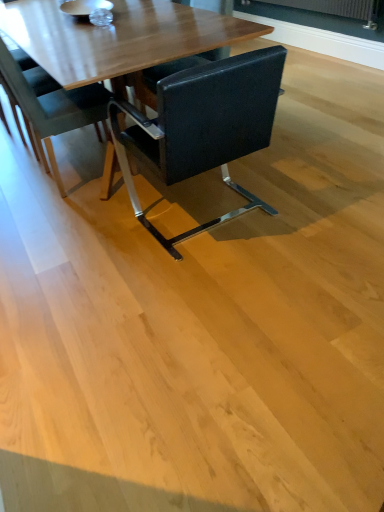
Question: Is black leather chair at center, arranged as the 1th chair when viewed from the right, aimed at black leather chair at center, the 1th chair viewed from the left?

Choices:
 (A) no
 (B) yes

Answer: (B)

Question: Considering the relative positions of black leather chair at center, the second chair in the left-to-right sequence, and black leather chair at center, the 1th chair viewed from the left, in the image provided, is black leather chair at center, the second chair in the left-to-right sequence, behind black leather chair at center, the 1th chair viewed from the left,?

Choices:
 (A) no
 (B) yes

Answer: (A)

Question: From a real-world perspective, is black leather chair at center, arranged as the 1th chair when viewed from the right, under black leather chair at center, the 1th chair viewed from the left?

Choices:
 (A) no
 (B) yes

Answer: (B)

Question: Is black leather chair at center, the 1th chair viewed from the left, at the back of black leather chair at center, the second chair in the left-to-right sequence?

Choices:
 (A) no
 (B) yes

Answer: (A)

Question: Is black leather chair at center, the second chair in the left-to-right sequence, taller than black leather chair at center, the 1th chair viewed from the left?

Choices:
 (A) yes
 (B) no

Answer: (B)

Question: Is black leather chair at center, arranged as the 1th chair when viewed from the right, wider than black leather chair at center, the 1th chair viewed from the left?

Choices:
 (A) no
 (B) yes

Answer: (B)

Question: Is black leather chair at center, the 1th chair viewed from the left, far away from black leather chair at center, arranged as the 1th chair when viewed from the right?

Choices:
 (A) no
 (B) yes

Answer: (A)

Question: From a real-world perspective, is black leather chair at center, arranged as the 2th chair when viewed from the right, over black leather chair at center, arranged as the 1th chair when viewed from the right?

Choices:
 (A) yes
 (B) no

Answer: (A)

Question: Can you confirm if black leather chair at center, the 1th chair viewed from the left, is bigger than black leather chair at center, the second chair in the left-to-right sequence?

Choices:
 (A) no
 (B) yes

Answer: (A)

Question: Does black leather chair at center, arranged as the 2th chair when viewed from the right, have a lesser width compared to black leather chair at center, the second chair in the left-to-right sequence?

Choices:
 (A) yes
 (B) no

Answer: (A)

Question: Is black leather chair at center, the second chair in the left-to-right sequence, completely or partially inside black leather chair at center, arranged as the 2th chair when viewed from the right?

Choices:
 (A) yes
 (B) no

Answer: (B)

Question: Considering the relative sizes of black leather chair at center, the 1th chair viewed from the left, and black leather chair at center, the second chair in the left-to-right sequence, in the image provided, is black leather chair at center, the 1th chair viewed from the left, taller than black leather chair at center, the second chair in the left-to-right sequence,?

Choices:
 (A) yes
 (B) no

Answer: (A)

Question: From the image's perspective, relative to black leather chair at center, arranged as the 1th chair when viewed from the right, is black leather chair at center, the 1th chair viewed from the left, above or below?

Choices:
 (A) below
 (B) above

Answer: (B)